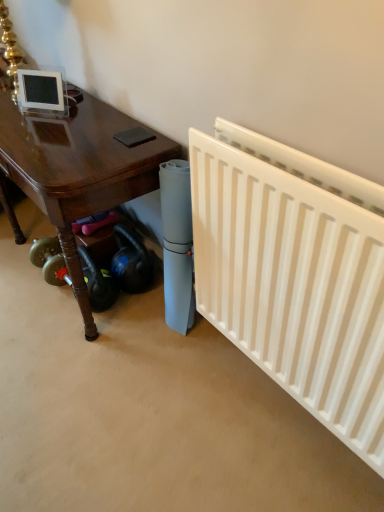
Question: Based on their sizes in the image, would you say glossy wood table at lower left is bigger or smaller than white matte radiator at right?

Choices:
 (A) big
 (B) small

Answer: (A)

Question: From a real-world perspective, is glossy wood table at lower left above or below white matte radiator at right?

Choices:
 (A) above
 (B) below

Answer: (B)

Question: Based on their positions, is glossy wood table at lower left located to the left or right of white matte radiator at right?

Choices:
 (A) right
 (B) left

Answer: (B)

Question: Visually, is white matte radiator at right positioned to the left or to the right of glossy wood table at lower left?

Choices:
 (A) right
 (B) left

Answer: (A)

Question: Considering the positions of white matte radiator at right and glossy wood table at lower left in the image, is white matte radiator at right taller or shorter than glossy wood table at lower left?

Choices:
 (A) short
 (B) tall

Answer: (B)

Question: From a real-world perspective, is white matte radiator at right physically located above or below glossy wood table at lower left?

Choices:
 (A) below
 (B) above

Answer: (B)

Question: From the image's perspective, is white matte radiator at right positioned above or below glossy wood table at lower left?

Choices:
 (A) above
 (B) below

Answer: (B)